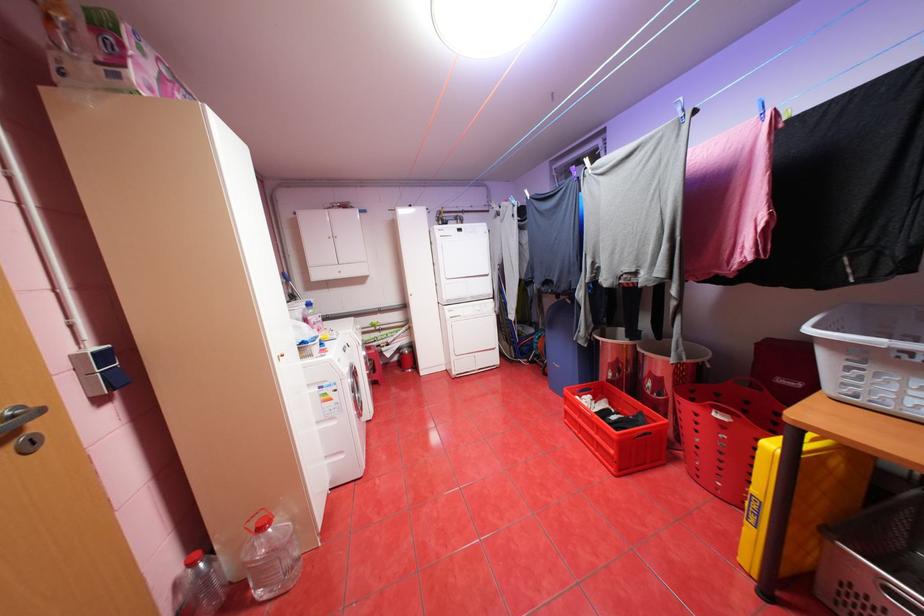
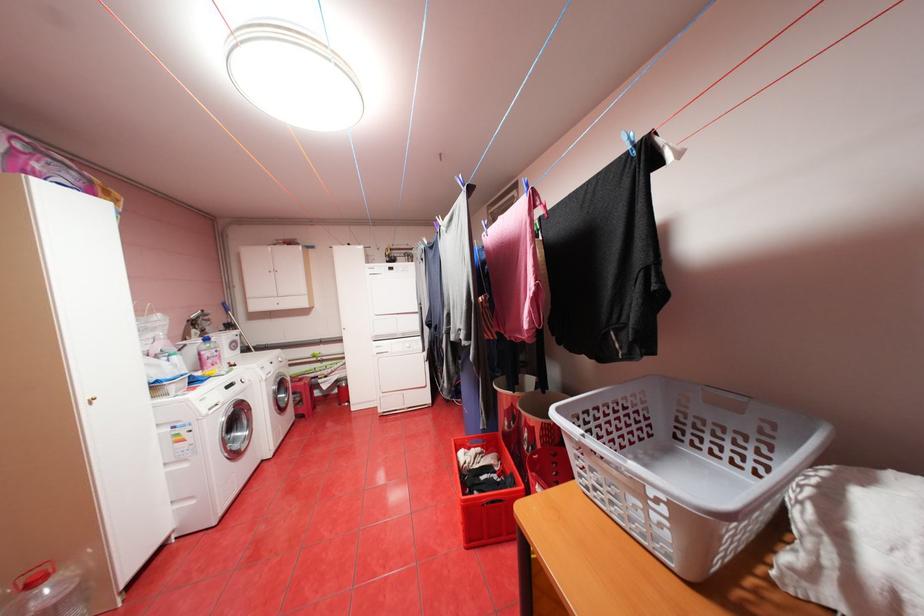
The point at (599, 395) is marked in the first image. Where is the corresponding point in the second image?

(488, 448)